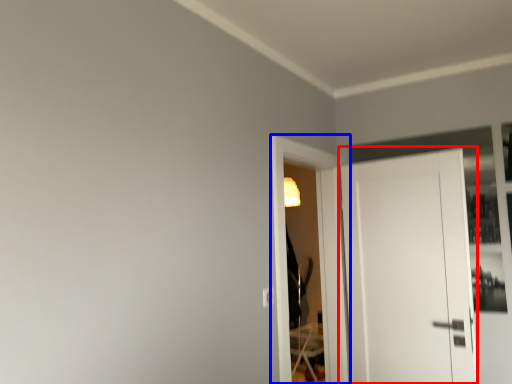
Question: Which object appears closest to the camera in this image, door (highlighted by a red box) or screen door (highlighted by a blue box)?

Choices:
 (A) door
 (B) screen door

Answer: (B)